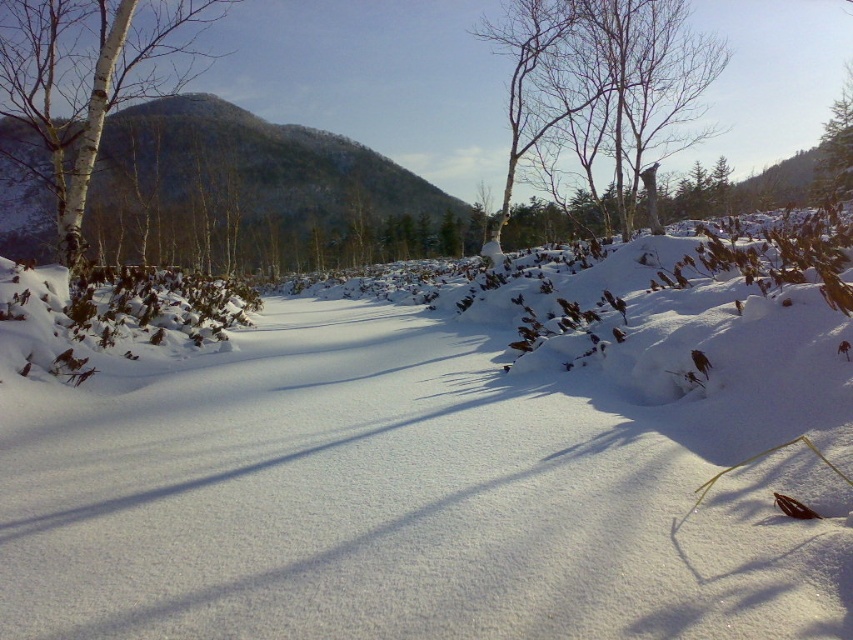
Does snowy forested hill at upper left appear on the left side of bare branches at upper center?

Correct, you'll find snowy forested hill at upper left to the left of bare branches at upper center.

Which is above, snowy forested hill at upper left or bare branches at upper center?

Positioned higher is snowy forested hill at upper left.

The width and height of the screenshot is (853, 640). Find the location of `snowy forested hill at upper left`. snowy forested hill at upper left is located at coordinates (254, 193).

Which is behind, point (708, 532) or point (125, 243)?

The point (125, 243) is more distant.

Is white fluffy snow at center in front of snowy forested hill at upper left?

Yes, white fluffy snow at center is in front of snowy forested hill at upper left.

Is point (413, 417) positioned before point (0, 122)?

Yes.

Locate an element on the screen. This screenshot has width=853, height=640. white fluffy snow at center is located at coordinates (451, 467).

Is bare branches at upper center smaller than white bark tree at left?

Yes, bare branches at upper center is smaller than white bark tree at left.

Is bare branches at upper center bigger than white bark tree at left?

Incorrect, bare branches at upper center is not larger than white bark tree at left.

Is point (601, 8) positioned behind point (59, 157)?

Yes, it is.

This screenshot has width=853, height=640. Find the location of `bare branches at upper center`. bare branches at upper center is located at coordinates (601, 83).